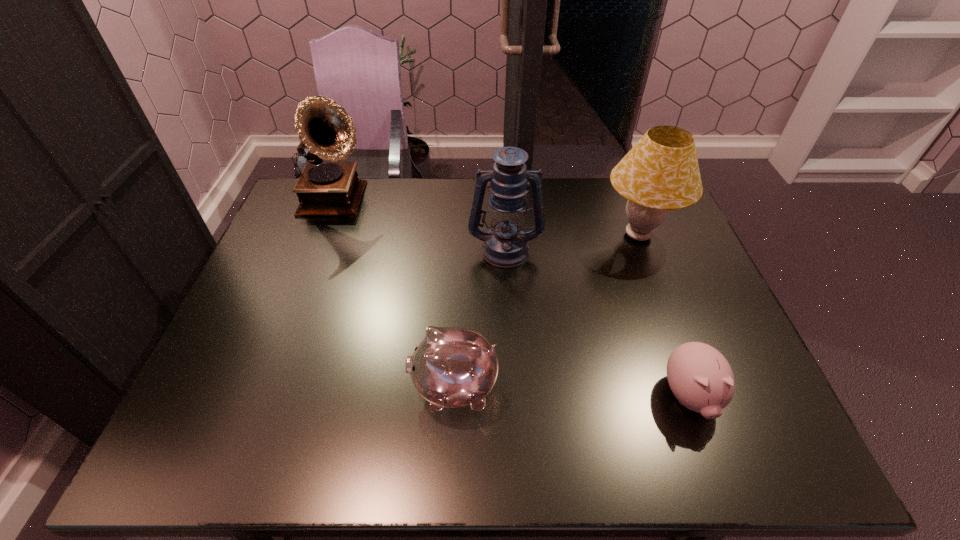
At what (x,y) coordinates should I click in order to perform the action: click on vacant position in the image that satisfies the following two spatial constraints: 1. on the front-facing side of the lantern; 2. on the front facing side of the taller piggy bank. Please return your answer as a coordinate pair (x, y). The width and height of the screenshot is (960, 540). Looking at the image, I should click on (514, 387).

At what (x,y) coordinates should I click in order to perform the action: click on vacant position in the image that satisfies the following two spatial constraints: 1. on the front-facing side of the lantern; 2. on the front facing side of the taller piggy bank. Please return your answer as a coordinate pair (x, y). Looking at the image, I should click on (514, 387).

In order to click on vacant area in the image that satisfies the following two spatial constraints: 1. on the front side of the lampshade; 2. on the front facing side of the taller piggy bank in this screenshot , I will do `click(696, 387)`.